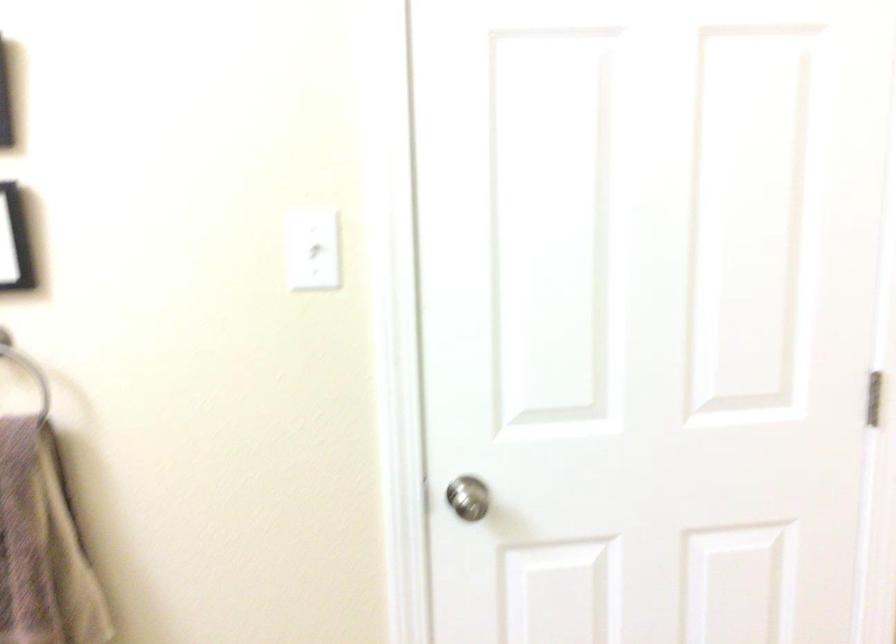
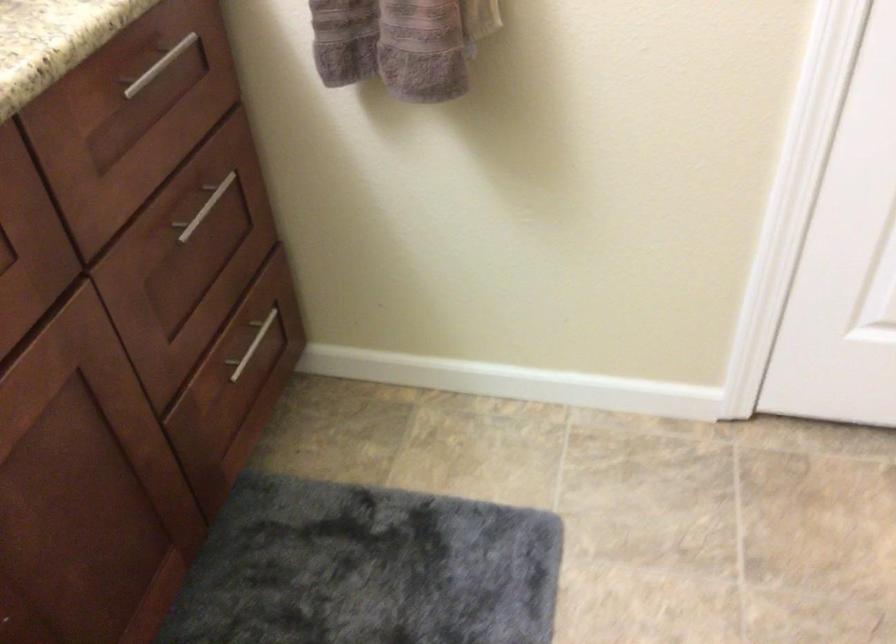
The images are taken continuously from a first-person perspective. In which direction is your viewpoint rotating?

The rotation direction of the camera is left-down.